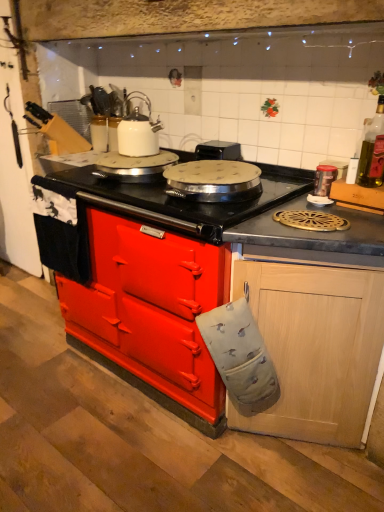
Question: Considering the positions of black plastic toaster at upper center and white glossy kettle at upper center, which appears as the first kitchen appliance when viewed from the top, in the image, is black plastic toaster at upper center taller or shorter than white glossy kettle at upper center, which appears as the first kitchen appliance when viewed from the top,?

Choices:
 (A) short
 (B) tall

Answer: (A)

Question: From a real-world perspective, relative to white glossy kettle at upper center, the 1th kitchen appliance positioned from the back, is black plastic toaster at upper center vertically above or below?

Choices:
 (A) above
 (B) below

Answer: (B)

Question: Estimate the real-world distances between objects in this image. Which object is farther from the black matte countertop at center?

Choices:
 (A) light wood/texture cabinet at lower right
 (B) black plastic toaster at upper center
 (C) white glossy kettle at upper center, the 1th kitchen appliance from the left
 (D) green glass bottle at upper right
 (E) metallic silver canister at upper right, the second kitchen appliance in the left-to-right sequence

Answer: (D)

Question: Considering the real-world distances, which object is farthest from the white glossy kettle at upper center, the 1th kitchen appliance from the left?

Choices:
 (A) light wood/texture cabinet at lower right
 (B) black matte countertop at center
 (C) black plastic toaster at upper center
 (D) metallic silver canister at upper right, placed as the second kitchen appliance when sorted from top to bottom
 (E) green glass bottle at upper right

Answer: (A)